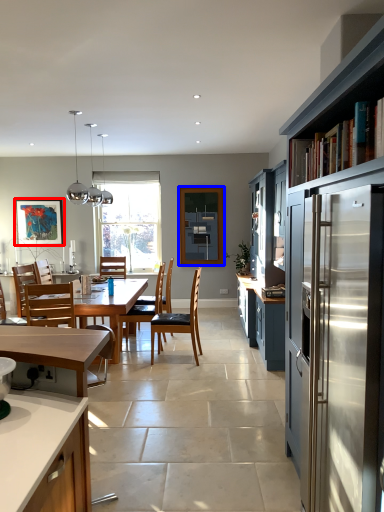
Question: Which object is closer to the camera taking this photo, picture frame (highlighted by a red box) or window screen (highlighted by a blue box)?

Choices:
 (A) picture frame
 (B) window screen

Answer: (B)